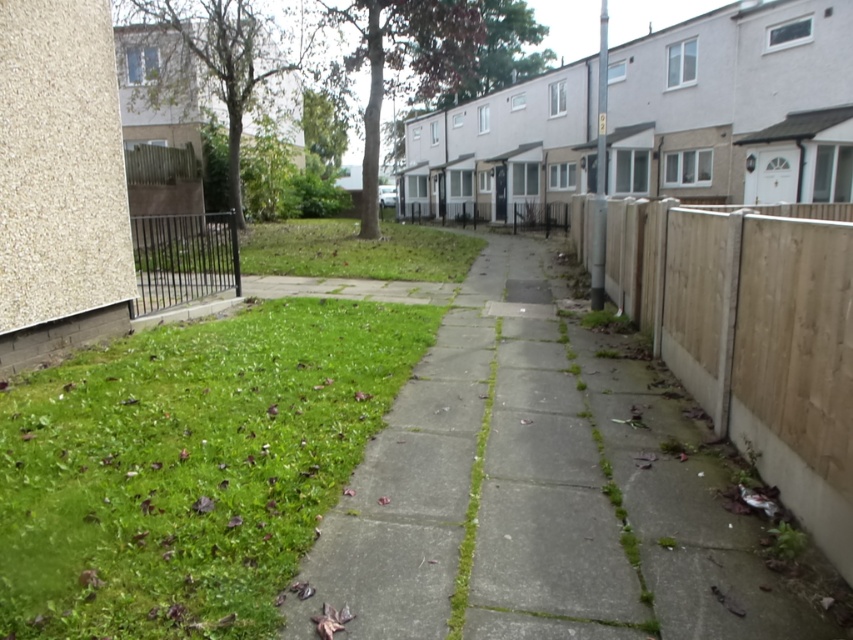
You are a delivery person with a cart that is 3 meters wide. You need to move through the space between the green concrete pavement at center and the wooden fence on the left. Is there enough space for your cart to pass through?

The space between the green concrete pavement at center and the wooden fence on the left is 2.95 meters, which is slightly narrower than the cart. Therefore, the cart cannot pass through this space safely.

You are a gardener who needs to mow the lawn. You see the green grass at lower left and the black metal fence at lower left. Which object is shorter and requires mowing?

The green grass at lower left is shorter than the black metal fence at lower left, so the green grass at lower left requires mowing.